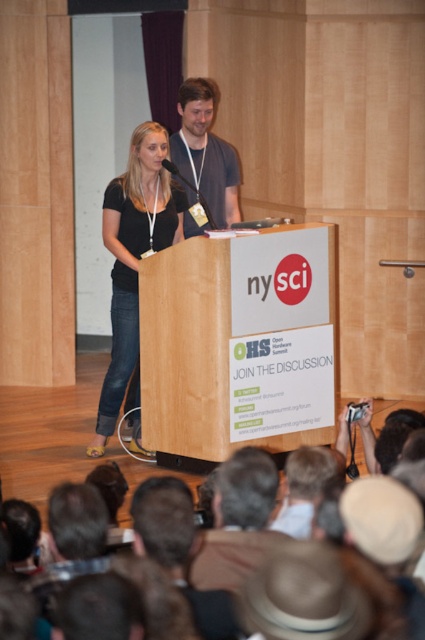
Question: Which object appears closest to the camera in this image?

Choices:
 (A) dark brown leather jacket at lower center
 (B) wooden podium at center
 (C) brown fabric crowd at lower center
 (D) matte black shirt at center

Answer: (A)

Question: Does dark brown leather jacket at lower center appear over dark gray shirt at center?

Choices:
 (A) no
 (B) yes

Answer: (A)

Question: Which of these objects is positioned closest to the wooden podium at center?

Choices:
 (A) matte black shirt at center
 (B) dark brown leather jacket at lower center
 (C) brown fabric crowd at lower center

Answer: (A)

Question: Is dark brown leather jacket at lower center closer to camera compared to dark gray shirt at center?

Choices:
 (A) no
 (B) yes

Answer: (B)

Question: Which is nearer to the dark gray shirt at center?

Choices:
 (A) dark brown leather jacket at lower center
 (B) wooden podium at center
 (C) brown fabric crowd at lower center

Answer: (B)

Question: Is dark brown leather jacket at lower center above dark gray shirt at center?

Choices:
 (A) no
 (B) yes

Answer: (A)